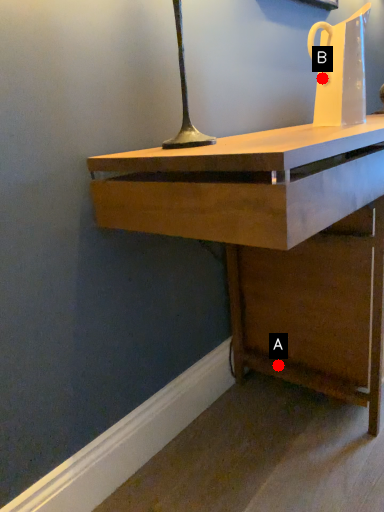
Question: Two points are circled on the image, labeled by A and B beside each circle. Which point is closer to the camera taking this photo?

Choices:
 (A) A is closer
 (B) B is closer

Answer: (B)